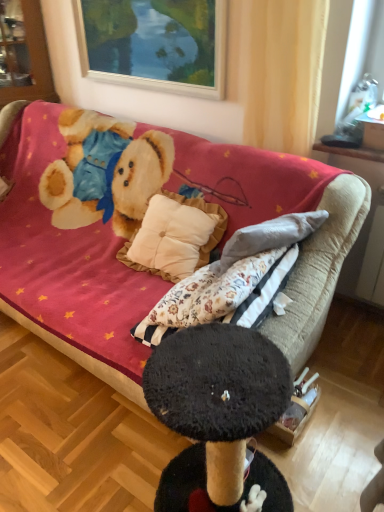
Question: Considering the positions of wooden picture frame at upper center and velvet beige couch at center in the image, is wooden picture frame at upper center taller or shorter than velvet beige couch at center?

Choices:
 (A) tall
 (B) short

Answer: (B)

Question: In the image, is wooden picture frame at upper center on the left side or the right side of velvet beige couch at center?

Choices:
 (A) left
 (B) right

Answer: (B)

Question: Which of these objects is positioned farthest from the velvet beige couch at center?

Choices:
 (A) yellow sheer curtain at upper center
 (B) wooden picture frame at upper center
 (C) brushed metal cabinet at upper left

Answer: (C)

Question: Which object is positioned closest to the yellow sheer curtain at upper center?

Choices:
 (A) brushed metal cabinet at upper left
 (B) velvet beige couch at center
 (C) wooden picture frame at upper center

Answer: (C)